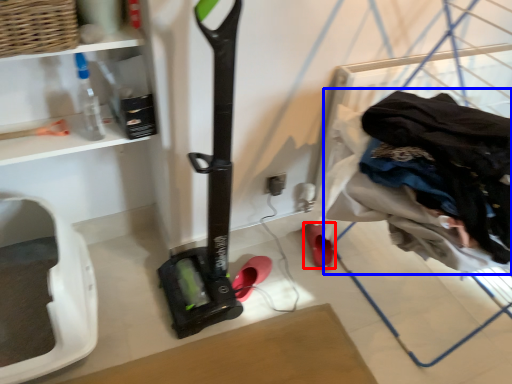
Question: Which of the following is the closest to the observer, footwear (highlighted by a red box) or clothing (highlighted by a blue box)?

Choices:
 (A) footwear
 (B) clothing

Answer: (B)